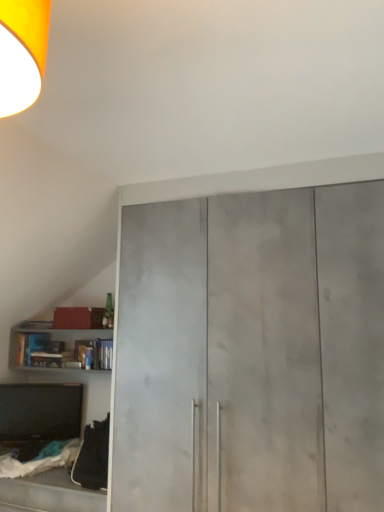
Question: From the image's perspective, is matte concrete cupboard at center under matte gray bookshelf at lower left?

Choices:
 (A) no
 (B) yes

Answer: (A)

Question: From the image's perspective, is matte concrete cupboard at center over matte gray bookshelf at lower left?

Choices:
 (A) yes
 (B) no

Answer: (A)

Question: Is matte concrete cupboard at center aimed at matte gray bookshelf at lower left?

Choices:
 (A) no
 (B) yes

Answer: (A)

Question: Is matte gray bookshelf at lower left at the back of matte concrete cupboard at center?

Choices:
 (A) no
 (B) yes

Answer: (A)

Question: Can you confirm if matte concrete cupboard at center is wider than matte gray bookshelf at lower left?

Choices:
 (A) yes
 (B) no

Answer: (A)

Question: Considering the relative sizes of matte concrete cupboard at center and matte gray bookshelf at lower left in the image provided, is matte concrete cupboard at center taller than matte gray bookshelf at lower left?

Choices:
 (A) no
 (B) yes

Answer: (B)

Question: From the image's perspective, is matte gray bookshelf at lower left located above matte concrete cupboard at center?

Choices:
 (A) yes
 (B) no

Answer: (B)

Question: Can you see matte gray bookshelf at lower left touching matte concrete cupboard at center?

Choices:
 (A) yes
 (B) no

Answer: (B)

Question: Is matte gray bookshelf at lower left shorter than matte concrete cupboard at center?

Choices:
 (A) yes
 (B) no

Answer: (A)

Question: Can you confirm if matte gray bookshelf at lower left is taller than matte concrete cupboard at center?

Choices:
 (A) yes
 (B) no

Answer: (B)

Question: Is matte gray bookshelf at lower left looking in the opposite direction of matte concrete cupboard at center?

Choices:
 (A) no
 (B) yes

Answer: (A)

Question: From a real-world perspective, is matte gray bookshelf at lower left on top of matte concrete cupboard at center?

Choices:
 (A) no
 (B) yes

Answer: (B)

Question: Is matte concrete cupboard at center taller or shorter than matte gray bookshelf at lower left?

Choices:
 (A) tall
 (B) short

Answer: (A)